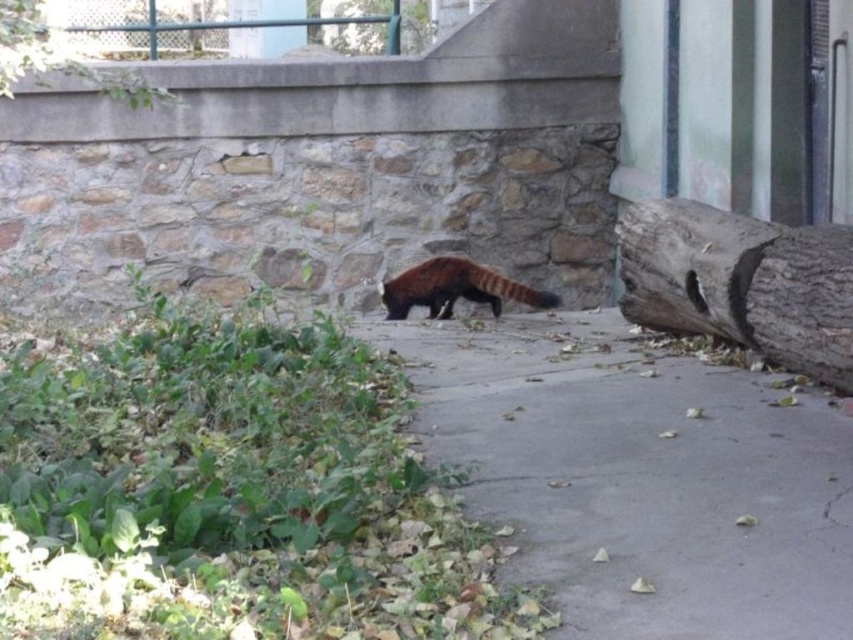
Question: Is green leafy tree at upper left in front of brown rough bark tree at upper center?

Choices:
 (A) no
 (B) yes

Answer: (B)

Question: Is gray concrete pavement at center bigger than fluffy reddish-brown animal at center?

Choices:
 (A) yes
 (B) no

Answer: (A)

Question: Which point is closer to the camera?

Choices:
 (A) (451, 268)
 (B) (746, 593)

Answer: (B)

Question: Considering the real-world distances, which object is closest to the gray rough bark tree trunk at right?

Choices:
 (A) green leafy tree at upper left
 (B) brown rough bark tree at upper center
 (C) gray concrete pavement at center

Answer: (C)

Question: Can you confirm if gray rough bark tree trunk at right is positioned to the right of brown rough bark tree at upper center?

Choices:
 (A) yes
 (B) no

Answer: (A)

Question: Among these points, which one is nearest to the camera?

Choices:
 (A) (692, 570)
 (B) (22, 8)

Answer: (A)